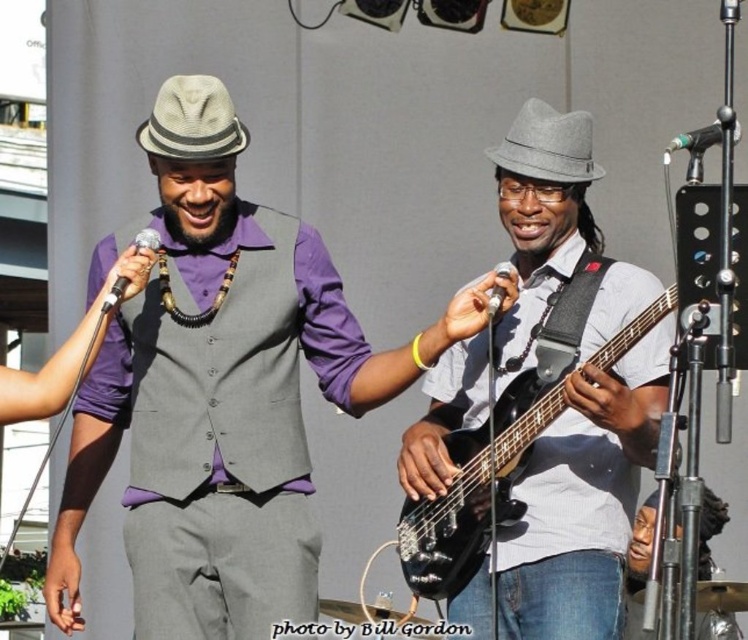
Looking at this image, you are standing at the center of the stage and want to move to the point closer to the audience. Which point should you go to, point (135, 243) or point (414, 364)?

Point (135, 243) is in front of point (414, 364), so you should go to point (135, 243) to be closer to the audience.

You are a stagehand setting up for a concert and need to place a 40 feet long extension cord between the metallic silver microphone at upper right and the matte silver microphone at upper left. Will the cord be long enough to reach both microphones?

The metallic silver microphone at upper right and matte silver microphone at upper left are 42.07 feet apart. The extension cord is only 40 feet long, so it will not be long enough to reach both microphones.